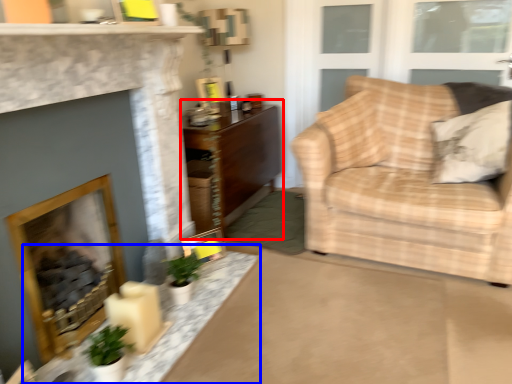
Question: Which of the following is the closest to the observer, table (highlighted by a red box) or table (highlighted by a blue box)?

Choices:
 (A) table
 (B) table

Answer: (B)